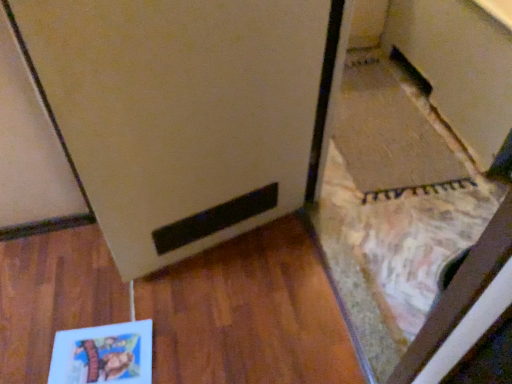
Question: Is matte paper book at lower left to the left or to the right of matte white fridge at center in the image?

Choices:
 (A) left
 (B) right

Answer: (A)

Question: Considering the positions of point (57, 380) and point (170, 34), is point (57, 380) closer or farther from the camera than point (170, 34)?

Choices:
 (A) farther
 (B) closer

Answer: (A)

Question: Which of these objects is positioned closest to the matte white fridge at center?

Choices:
 (A) matte paper book at lower left
 (B) matte brown cabinet at lower right

Answer: (A)

Question: Estimate the real-world distances between objects in this image. Which object is closer to the matte brown cabinet at lower right?

Choices:
 (A) matte white fridge at center
 (B) matte paper book at lower left

Answer: (A)